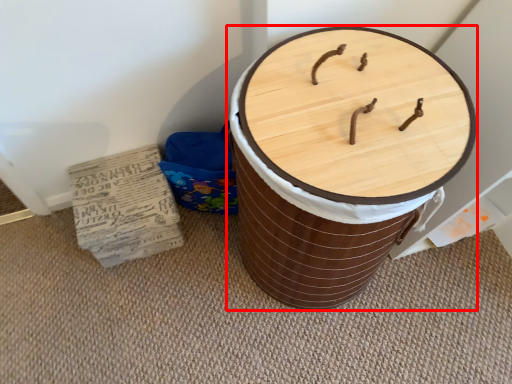
Question: Observing the image, what is the correct spatial positioning of furniture (annotated by the red box) in reference to cardboard?

Choices:
 (A) right
 (B) left

Answer: (A)